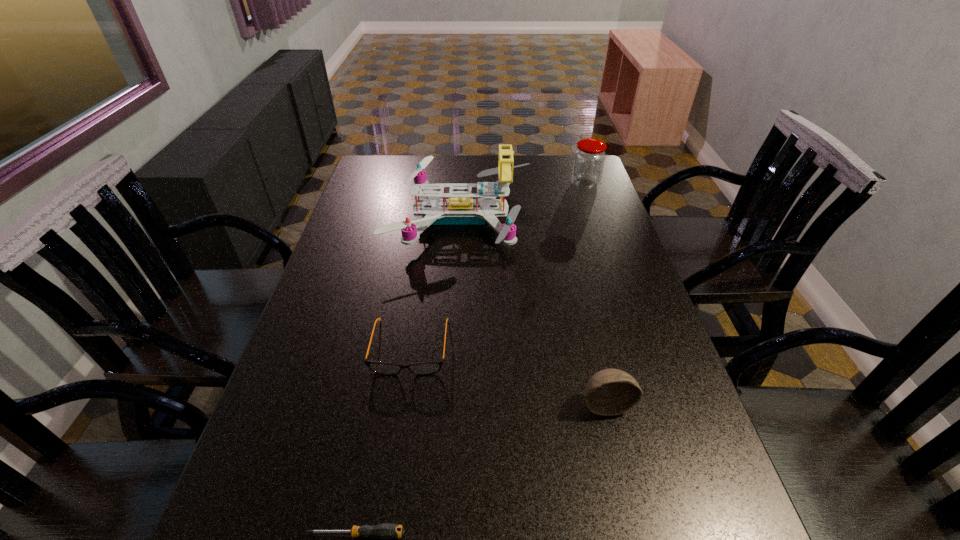
In the image, there is a desktop. In order to click on vacant space at the right edge in this screenshot , I will do `click(625, 279)`.

Locate an element on the screen. vacant space at the far left corner is located at coordinates (379, 176).

Locate an element on the screen. The image size is (960, 540). free space between the jar and the tallest object is located at coordinates 523,202.

Locate an element on the screen. Image resolution: width=960 pixels, height=540 pixels. free space between the second shortest object and the second nearest object is located at coordinates (508, 375).

This screenshot has width=960, height=540. Find the location of `free spot between the tallest object and the second tallest object`. free spot between the tallest object and the second tallest object is located at coordinates (523, 202).

Where is `vacant area between the jar and the spectacles`? The width and height of the screenshot is (960, 540). vacant area between the jar and the spectacles is located at coordinates (497, 266).

Locate an element on the screen. Image resolution: width=960 pixels, height=540 pixels. free point between the fourth farthest object and the fourth tallest object is located at coordinates (508, 375).

Find the location of a particular element. vacant point located between the spectacles and the fourth shortest object is located at coordinates (497, 266).

You are a GUI agent. You are given a task and a screenshot of the screen. Output one action in this format:
    pyautogui.click(x=<x>, y=<y>)
    Task: Click on the free area in between the jar and the third shortest object
    The height and width of the screenshot is (540, 960).
    Given the screenshot: What is the action you would take?
    pyautogui.click(x=595, y=294)

Select which object appears as the fourth closest to the second tallest object. Please provide its 2D coordinates. Your answer should be formatted as a tuple, i.e. [(x, y)], where the tuple contains the x and y coordinates of a point satisfying the conditions above.

[(385, 532)]